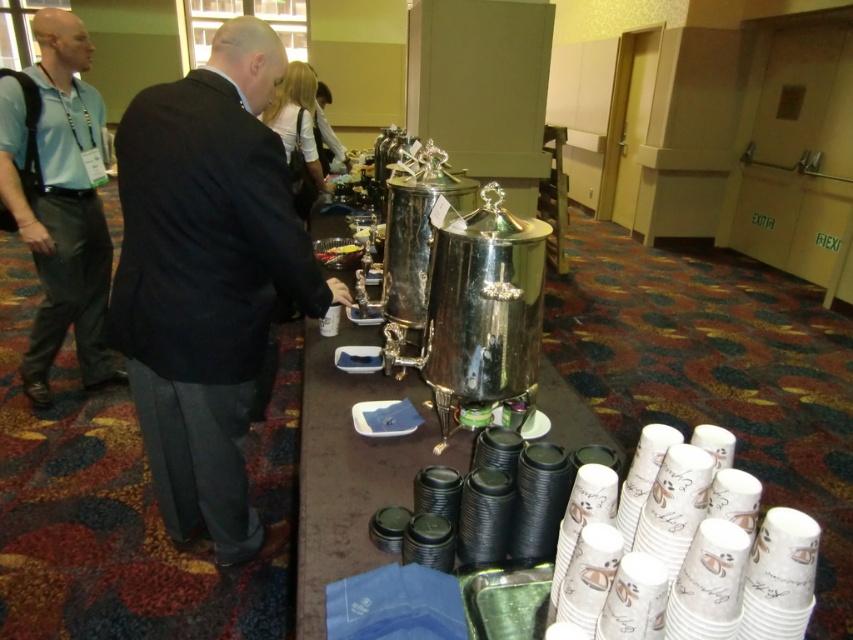
You are organizing a conference and need to decide which clothing item to place on the table for a promotional display. The black suit at center and the matte blue shirt at left are both options. Based on their sizes, which one would you choose to ensure it stands out more visually?

The black suit at center is larger in size than the matte blue shirt at left, so choosing the black suit at center would make it stand out more visually on the promotional display.

You are a guest at the event and need to reach the polished silver coffee pot at center to pour yourself a cup of coffee. However, there is a black suit at center in your way. Based on the scene description, can you easily access the coffee pot without moving the suit?

The black suit at center is above the polished silver coffee pot at center, so the suit is positioned higher than the coffee pot. Since the suit is above it, you can likely access the coffee pot without moving the suit as it might be placed on a lower surface or area beneath the suit.

You are attending a formal event and need to choose between wearing the black suit at center or the polished silver coffee pot at center. Which item is bigger and more suitable for your outfit?

The black suit at center is larger in size than the polished silver coffee pot at center, so it would be more suitable for your outfit.